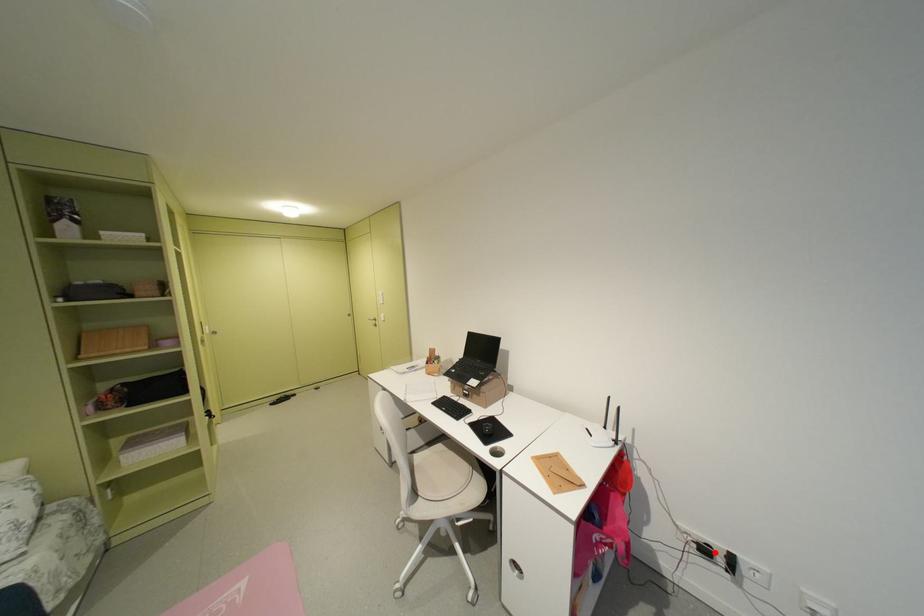
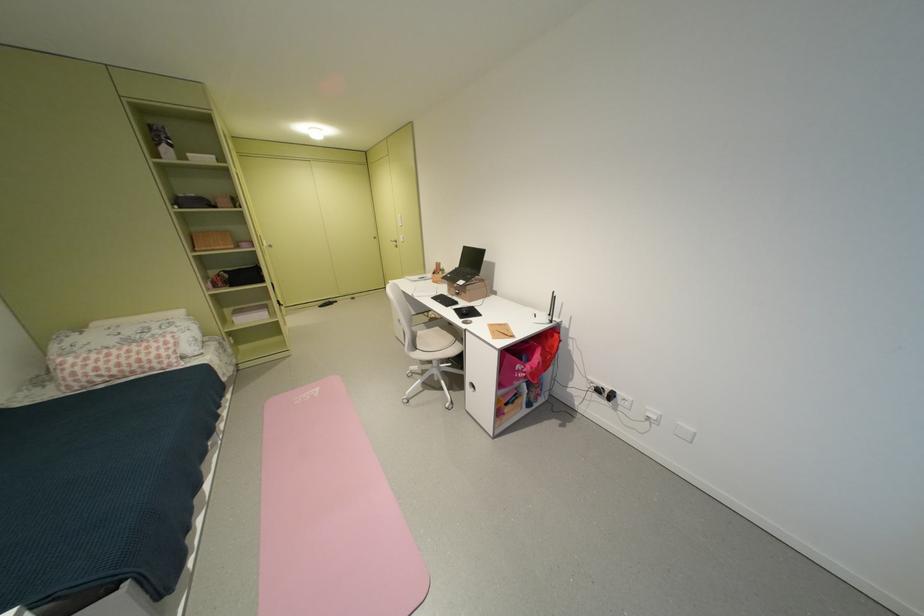
Find the pixel in the second image that matches the highlighted location in the first image.

(609, 392)